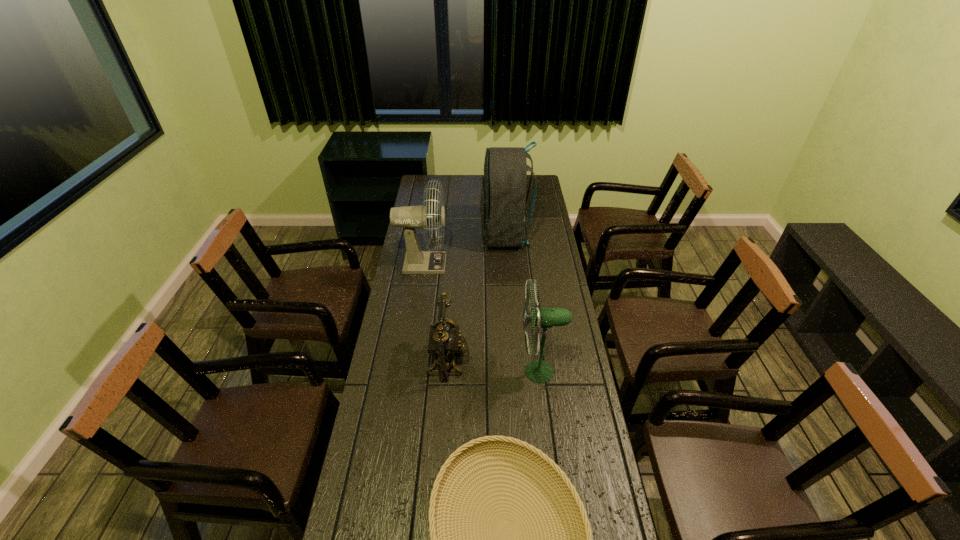
What are the coordinates of `free spot located 0.230m on the front-facing side of the nearer fan` in the screenshot? It's located at (454, 372).

You are a GUI agent. You are given a task and a screenshot of the screen. Output one action in this format:
    pyautogui.click(x=<x>, y=<y>)
    Task: Click on the vacant space located 0.090m on the rotary dial of the fourth tallest object
    Image resolution: width=960 pixels, height=540 pixels.
    Given the screenshot: What is the action you would take?
    pyautogui.click(x=493, y=361)

Find the location of a particular element. This screenshot has height=540, width=960. object present at the left edge is located at coordinates (416, 261).

This screenshot has height=540, width=960. Find the location of `backpack that is at the right edge`. backpack that is at the right edge is located at coordinates (503, 200).

The width and height of the screenshot is (960, 540). Identify the location of fan situated at the right edge. (539, 371).

At what (x,y) coordinates should I click in order to perform the action: click on vacant region at the far edge of the desktop. Please return your answer as a coordinate pair (x, y). The height and width of the screenshot is (540, 960). Looking at the image, I should click on (452, 177).

In the image, there is a desktop. Where is `vacant space at the left edge`? The image size is (960, 540). vacant space at the left edge is located at coordinates (361, 497).

In the image, there is a desktop. Identify the location of vacant space at the right edge. (572, 364).

Image resolution: width=960 pixels, height=540 pixels. Find the location of `vacant space at the far left corner of the desktop`. vacant space at the far left corner of the desktop is located at coordinates (430, 178).

Locate an element on the screen. This screenshot has height=540, width=960. vacant space in between the left fan and the tallest object is located at coordinates (464, 249).